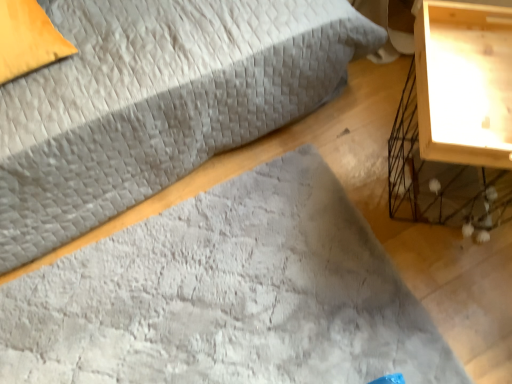
This screenshot has height=384, width=512. I want to click on vacant space in between wooden nightstand at right and textured gray mat at center, so click(x=421, y=244).